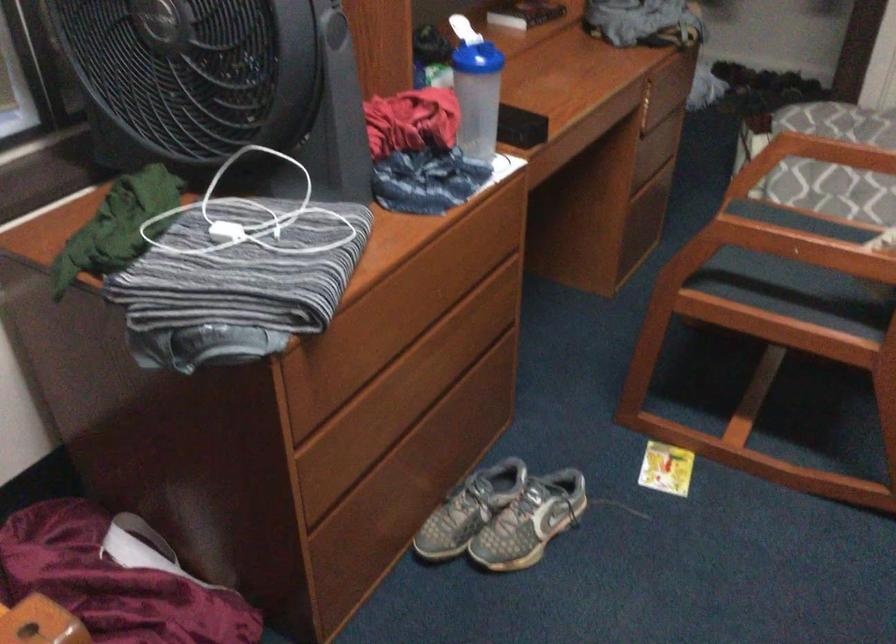
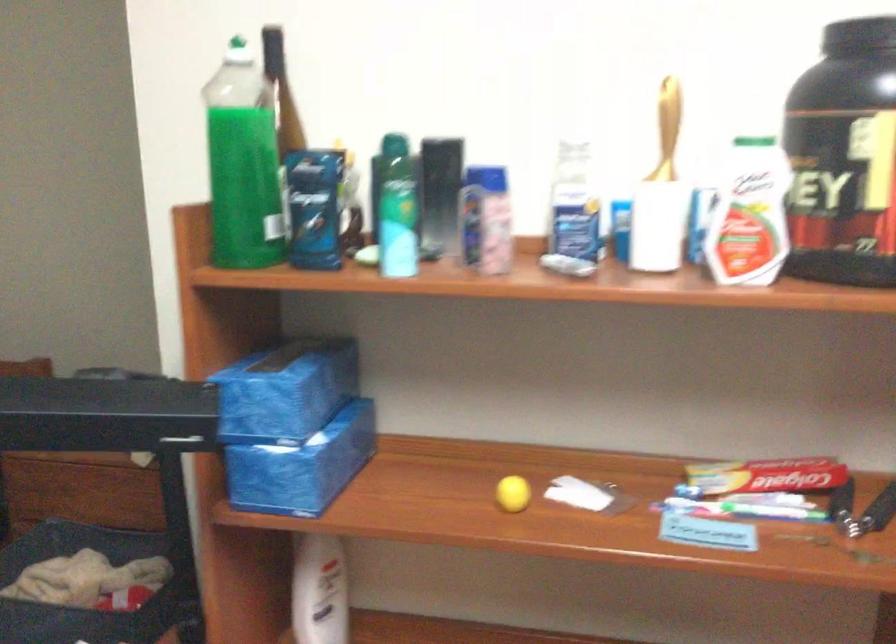
In the scene shown: How did the camera likely rotate?

The camera rotated toward right-down.